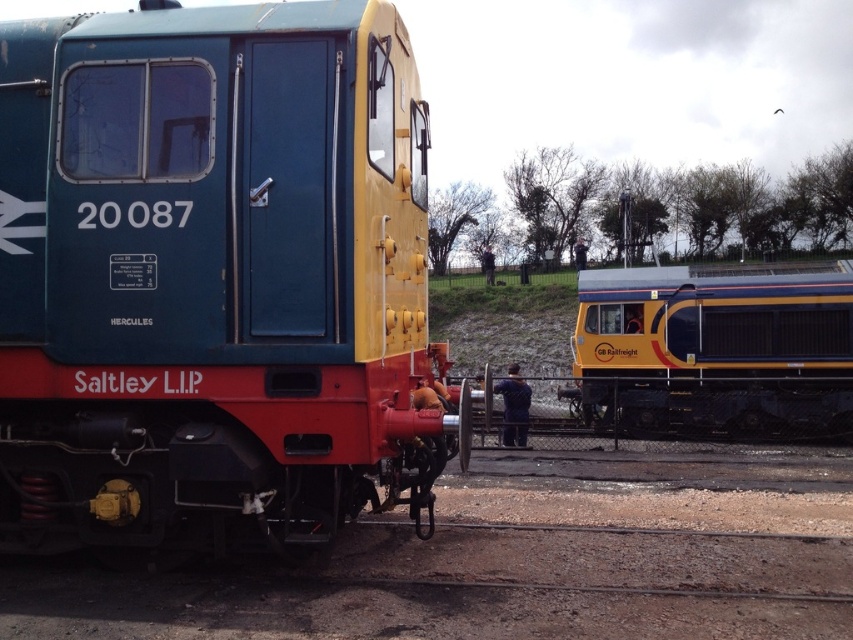
Looking at this image, you are a train conductor who needs to determine the best path for a new locomotive to enter the station. Given the scene described, which object takes up more space in the image, the dirt track at lower center or the yellow metallic train at right?

The yellow metallic train at right takes up more space in the image than the dirt track at lower center, as the dirt track at lower center occupies less space than yellow metallic train at right.

You are a maintenance worker needing to reach the dirt track at lower center from the matte blue train at center. Can you walk directly to it without needing to detour around any obstacles?

The matte blue train at center is 1.82 meters away from the dirt track at lower center, so yes, you can walk directly to it without needing to detour around any obstacles since the distance is manageable.

You are a railway inspector standing at the platform and need to check both the matte blue train at center and the yellow metallic train at right. Which train should you check first if you want to start with the one closer to your current position?

The matte blue train at center is to the left of the yellow metallic train at right, so the matte blue train at center is closer to your position on the platform. Check it first.